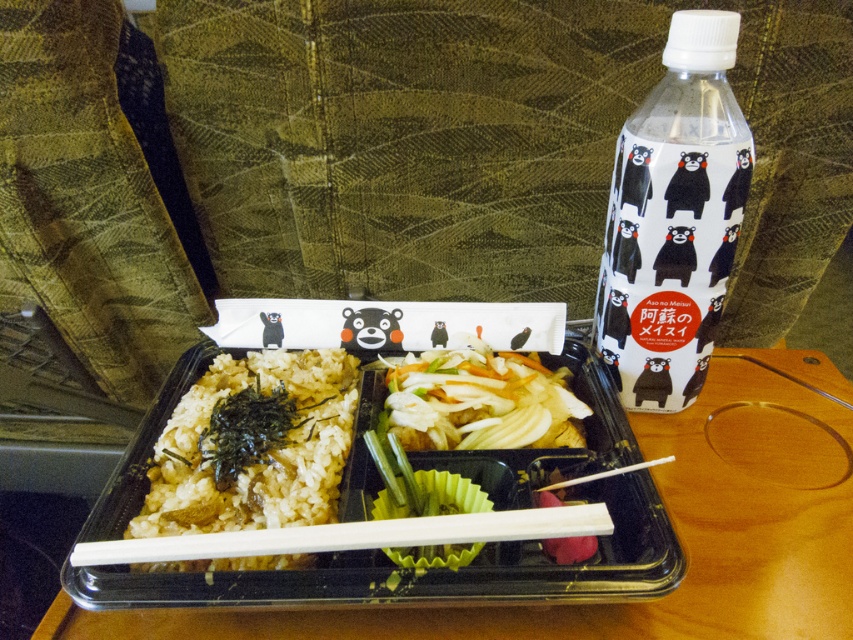
Is transparent plastic tray at center thinner than white plastic chopstick at lower center?

In fact, transparent plastic tray at center might be wider than white plastic chopstick at lower center.

Where is `transparent plastic tray at center`? This screenshot has height=640, width=853. transparent plastic tray at center is located at coordinates (671, 524).

Does point (851, 396) come closer to viewer compared to point (630, 470)?

That is False.

At what (x,y) coordinates should I click in order to perform the action: click on transparent plastic tray at center. Please return your answer as a coordinate pair (x, y). Image resolution: width=853 pixels, height=640 pixels. Looking at the image, I should click on (671, 524).

Which is more to the right, white glossy vegetables at center or white plastic chopstick at lower center?

Positioned to the right is white plastic chopstick at lower center.

Does white glossy vegetables at center have a lesser width compared to white plastic chopstick at lower center?

No, white glossy vegetables at center is not thinner than white plastic chopstick at lower center.

Between point (477, 406) and point (552, 483), which one is positioned in front?

Positioned in front is point (552, 483).

Locate an element on the screen. The width and height of the screenshot is (853, 640). white glossy vegetables at center is located at coordinates (480, 401).

Who is taller, transparent plastic tray at center or white plastic bottle at upper right?

white plastic bottle at upper right

This screenshot has height=640, width=853. Describe the element at coordinates (671, 524) in the screenshot. I see `transparent plastic tray at center` at that location.

Does point (602, 618) lie in front of point (608, 221)?

Yes, point (602, 618) is in front of point (608, 221).

Where is `transparent plastic tray at center`? This screenshot has width=853, height=640. transparent plastic tray at center is located at coordinates (671, 524).